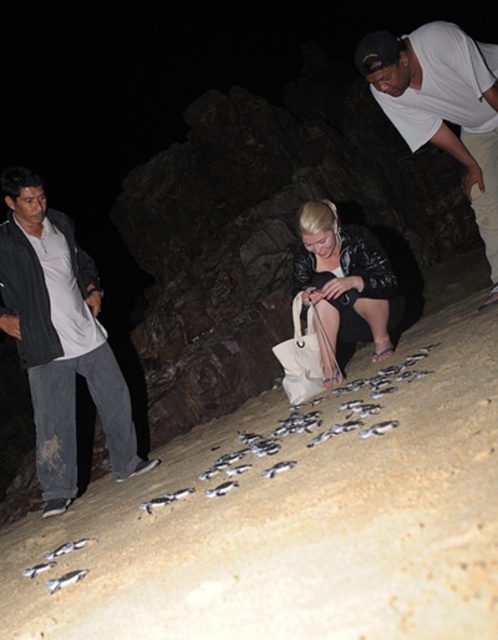
Question: Which point is closer to the camera?

Choices:
 (A) (372, 360)
 (B) (482, 147)
 (C) (476, 554)
 (D) (46, 515)

Answer: (C)

Question: Considering the real-world distances, which object is farthest from the dark gray jacket at left?

Choices:
 (A) light brown sandy beach at center
 (B) white matte shirt at upper right

Answer: (B)

Question: Which point is closer to the camera?

Choices:
 (A) dark gray jacket at left
 (B) black leather jacket at center
 (C) white matte shirt at upper right

Answer: (C)

Question: In this image, where is light brown sandy beach at center located relative to white matte shirt at upper right?

Choices:
 (A) left
 (B) right

Answer: (A)

Question: Does dark gray jacket at left have a smaller size compared to black leather jacket at center?

Choices:
 (A) yes
 (B) no

Answer: (B)

Question: Does dark gray jacket at left appear on the right side of black leather jacket at center?

Choices:
 (A) yes
 (B) no

Answer: (B)